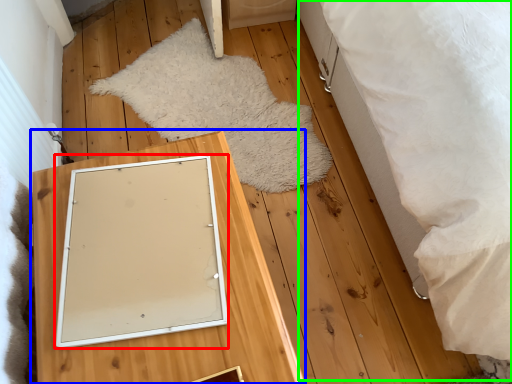
Question: Which object is positioned closest to picture frame (highlighted by a red box)? Select from furniture (highlighted by a blue box) and bed (highlighted by a green box).

Choices:
 (A) furniture
 (B) bed

Answer: (A)